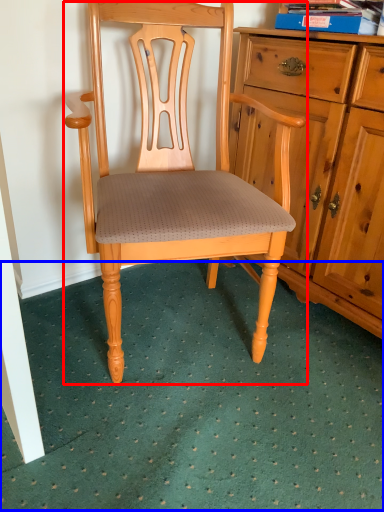
Question: Among these objects, which one is farthest to the camera, chair (highlighted by a red box) or doormat (highlighted by a blue box)?

Choices:
 (A) chair
 (B) doormat

Answer: (A)